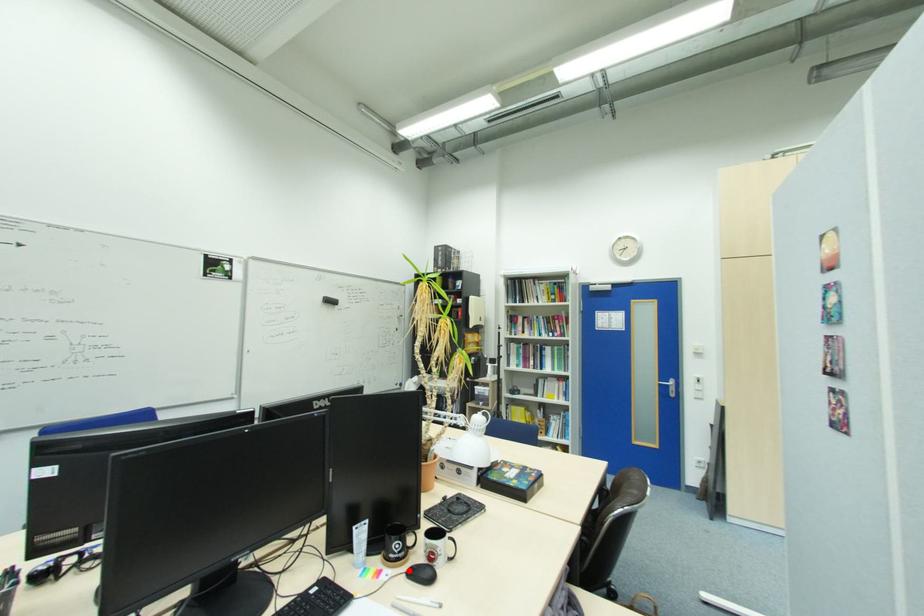
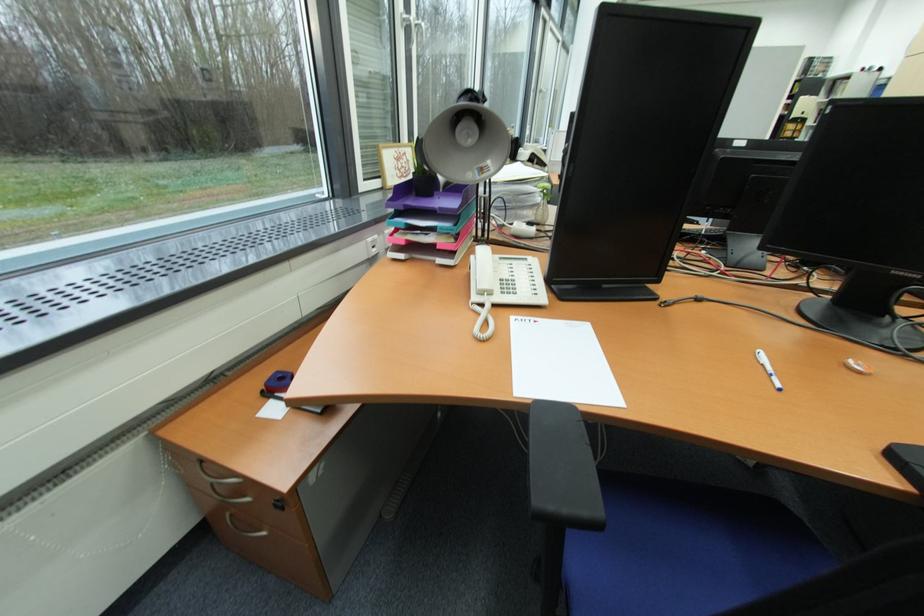
Question: I am providing you with two images of the same scene from different viewpoints. A red point is marked on the first image. Is the red point's position out of view in image 2?

Choices:
 (A) Yes
 (B) No

Answer: (A)